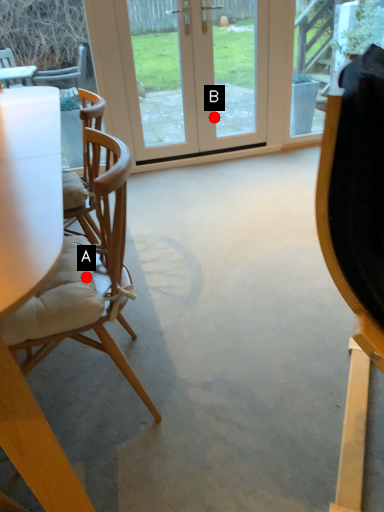
Question: Two points are circled on the image, labeled by A and B beside each circle. Which point appears farthest from the camera in this image?

Choices:
 (A) A is further
 (B) B is further

Answer: (B)